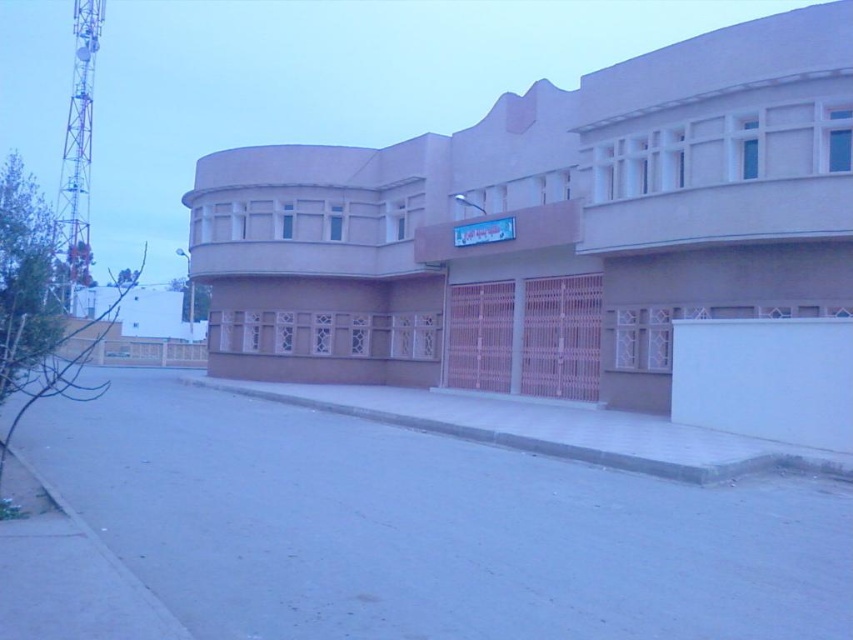
Question: Does beige concrete building at center appear under gray concrete curb at lower center?

Choices:
 (A) no
 (B) yes

Answer: (A)

Question: Does beige concrete building at center have a larger size compared to gray concrete curb at lower center?

Choices:
 (A) yes
 (B) no

Answer: (A)

Question: Which of the following is the farthest from the observer?

Choices:
 (A) (819, 166)
 (B) (361, 394)

Answer: (B)

Question: Which object appears closest to the camera in this image?

Choices:
 (A) beige concrete building at center
 (B) gray concrete curb at lower center

Answer: (B)

Question: Which of the following is the closest to the observer?

Choices:
 (A) gray concrete curb at lower center
 (B) beige concrete building at center

Answer: (A)

Question: Can you confirm if beige concrete building at center is wider than gray concrete curb at lower center?

Choices:
 (A) yes
 (B) no

Answer: (A)